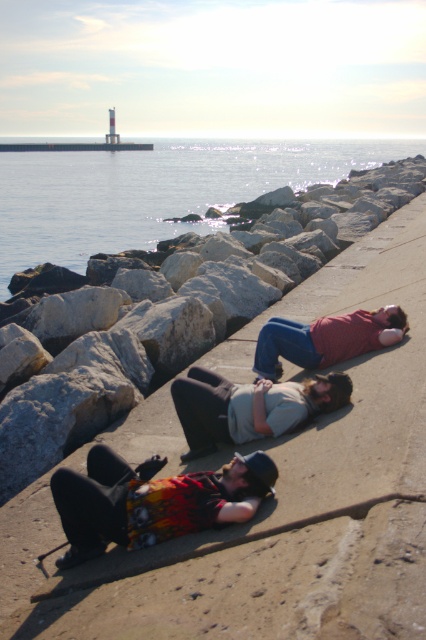
You are a swimmer who wants to jump into the clear water at center. From your position on the concrete at center, will you land directly in the water?

Yes, because the concrete at center is below clear water at center, so jumping from there will land you directly in the water.

You are standing at the edge of the pier and want to reach a specific point marked at coordinates point (354, 300). Can you safely walk to that point if your maximum comfortable walking distance is 25 feet?

The distance between you and point (354, 300) is 27.54 feet, which exceeds your maximum comfortable walking distance of 25 feet. Therefore, it may not be safe to walk to that point.

You are a photographer standing at the edge of the pier. You want to take a photo of the printed cotton shirt at lower left and the matte red shirt at center so that both are fully visible in the frame. The minimum distance between them for your camera to focus on both is 2 meters. Can you capture them in a single shot?

Yes, the printed cotton shirt at lower left and the matte red shirt at center are 2.15 meters apart, which exceeds the minimum required distance of 2 meters. Therefore, the camera can focus on both, allowing them to be captured in a single shot.